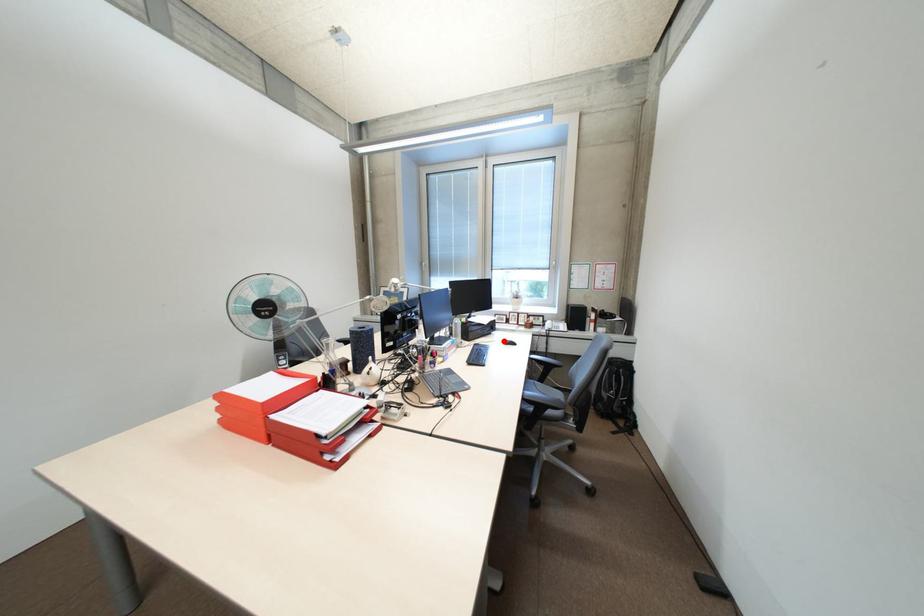
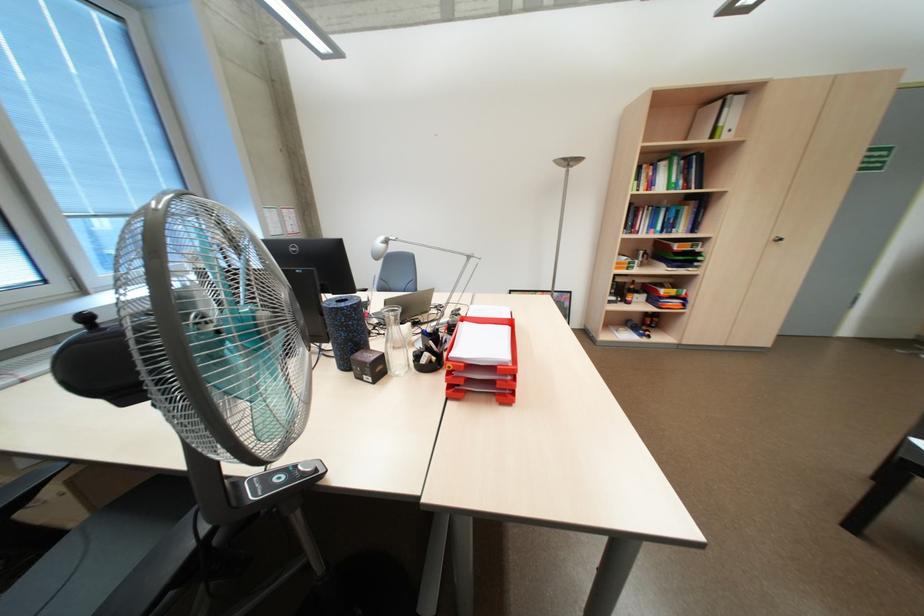
Question: I am providing you with two images of the same scene from different viewpoints. A red point is marked on the first image. Can you still see the location of the red point in image 2?

Choices:
 (A) Yes
 (B) No

Answer: (B)